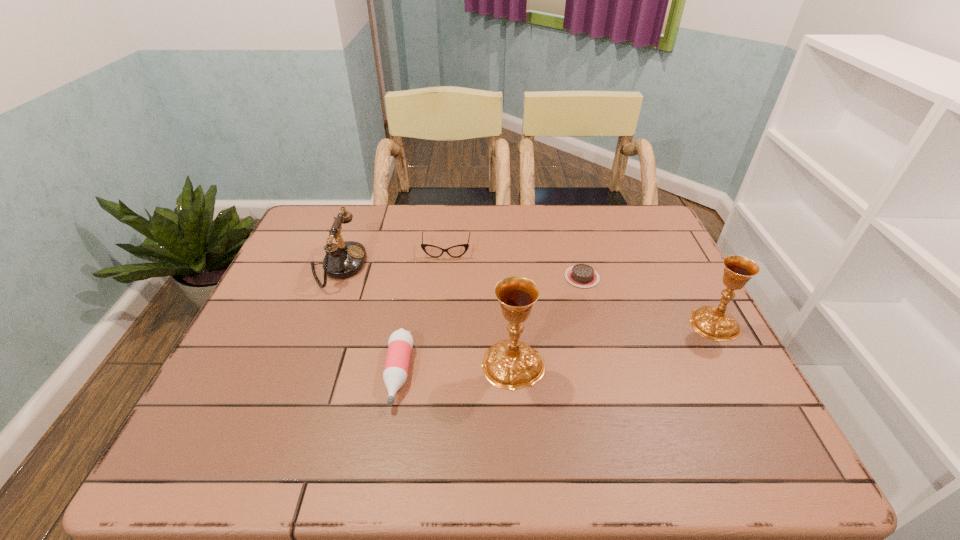
Identify the location of free space located 0.070m on the back of the fourth object from left to right. (510, 319).

Where is `free space located 0.290m on the left of the shorter chalice`? free space located 0.290m on the left of the shorter chalice is located at coordinates (574, 323).

The width and height of the screenshot is (960, 540). Find the location of `vacant space situated on the dial of the telephone`. vacant space situated on the dial of the telephone is located at coordinates (479, 266).

Where is `free space located 0.320m on the front of the second object from right to left`? This screenshot has height=540, width=960. free space located 0.320m on the front of the second object from right to left is located at coordinates (612, 388).

The height and width of the screenshot is (540, 960). In order to click on blank area located on the front-facing side of the spectacles in this screenshot , I will do `click(443, 287)`.

Locate an element on the screen. telephone located in the far edge section of the desktop is located at coordinates (342, 260).

This screenshot has height=540, width=960. What are the coordinates of `spectacles that is at the far edge` in the screenshot? It's located at (456, 251).

Where is `chalice present at the near edge`? This screenshot has height=540, width=960. chalice present at the near edge is located at coordinates (509, 364).

Locate an element on the screen. The width and height of the screenshot is (960, 540). bottle located in the near edge section of the desktop is located at coordinates (400, 343).

Identify the location of object at the left edge. The height and width of the screenshot is (540, 960). (342, 260).